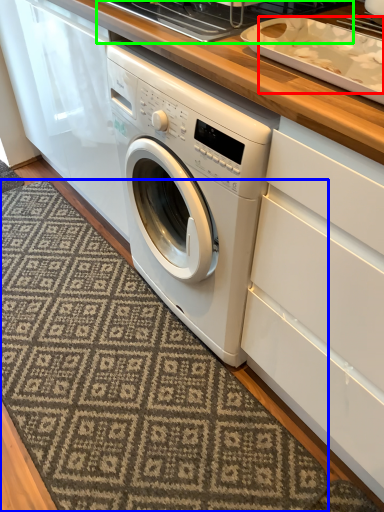
Question: Considering the real-world distances, which object is farthest from food (highlighted by a red box)? doormat (highlighted by a blue box) or appliance (highlighted by a green box)?

Choices:
 (A) doormat
 (B) appliance

Answer: (A)